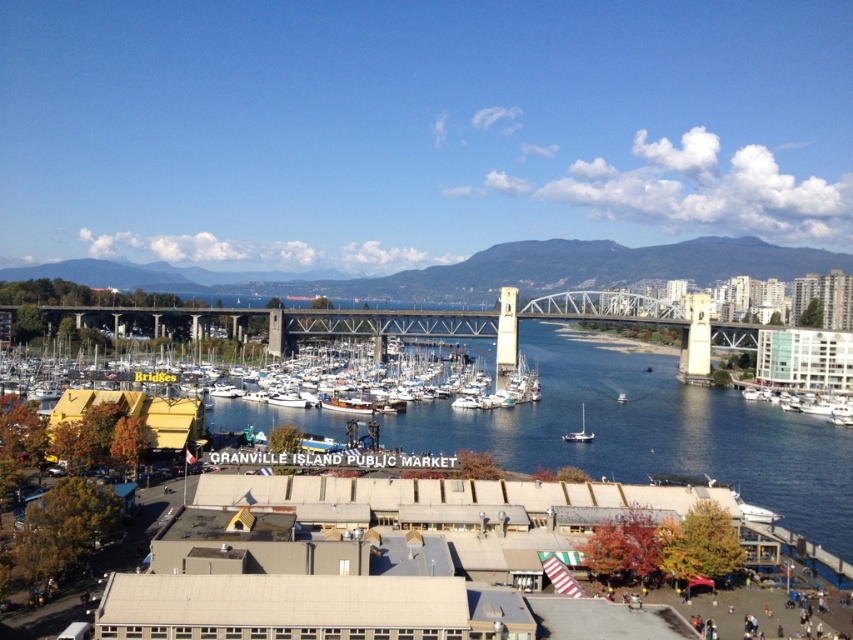
Is blue water at center bigger than white glossy boat at right?

Yes, blue water at center is bigger than white glossy boat at right.

Is blue water at center thinner than white glossy boat at right?

No, blue water at center is not thinner than white glossy boat at right.

Between point (579, 404) and point (846, 417), which one is positioned behind?

The point (579, 404) is behind.

You are a GUI agent. You are given a task and a screenshot of the screen. Output one action in this format:
    pyautogui.click(x=<x>, y=<y>)
    Task: Click on the blue water at center
    The width and height of the screenshot is (853, 640).
    Given the screenshot: What is the action you would take?
    pyautogui.click(x=651, y=433)

Does blue water at center appear under white matte boat at center?

Actually, blue water at center is above white matte boat at center.

Is point (467, 339) closer to viewer compared to point (616, 401)?

No, (467, 339) is behind (616, 401).

Locate an element on the screen. This screenshot has height=640, width=853. blue water at center is located at coordinates (651, 433).

Is point (851, 397) less distant than point (618, 394)?

Yes, point (851, 397) is closer to viewer.

Can you confirm if white glossy boat at right is positioned to the right of white matte boat at center?

Correct, you'll find white glossy boat at right to the right of white matte boat at center.

Image resolution: width=853 pixels, height=640 pixels. Find the location of `white glossy boat at right`. white glossy boat at right is located at coordinates (805, 403).

Locate an element on the screen. white glossy boat at right is located at coordinates (805, 403).